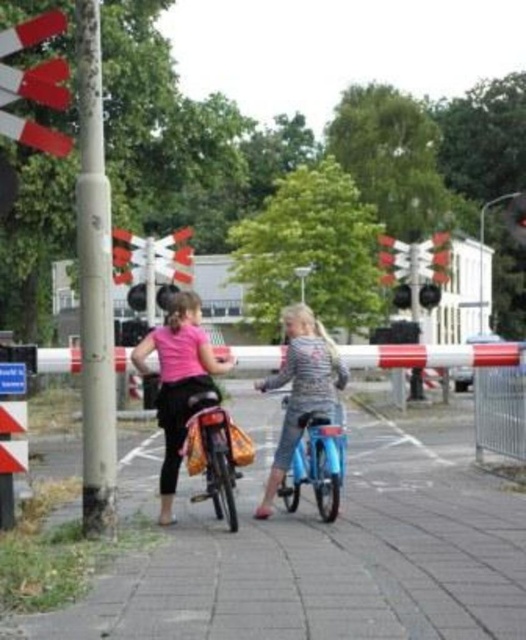
Find the location of `matte black bicycle at center`. matte black bicycle at center is located at coordinates (213, 454).

Between white plastic traffic light at upper left and matte black bicycle at center, which one is positioned higher?

white plastic traffic light at upper left is higher up.

At what (x,y) coordinates should I click in order to perform the action: click on white plastic traffic light at upper left. Please return your answer as a coordinate pair (x, y). This screenshot has height=640, width=526. Looking at the image, I should click on (34, 83).

What do you see at coordinates (34, 83) in the screenshot? This screenshot has height=640, width=526. I see `white plastic traffic light at upper left` at bounding box center [34, 83].

Between white plastic traffic light at upper left and metallic red traffic light at upper right, which one is positioned higher?

white plastic traffic light at upper left

Between point (65, 150) and point (515, 236), which one is positioned behind?

The point (515, 236) is behind.

Where is `white plastic traffic light at upper left`? The width and height of the screenshot is (526, 640). white plastic traffic light at upper left is located at coordinates (34, 83).